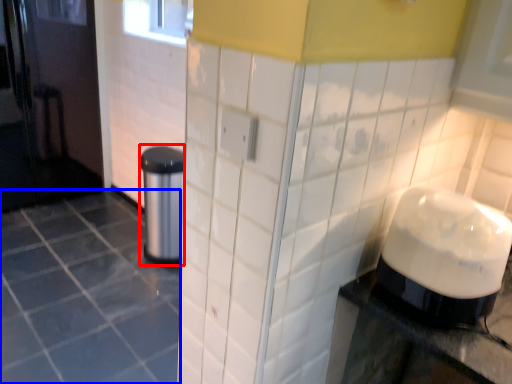
Question: Which object appears farthest to the camera in this image, appliance (highlighted by a red box) or ceramic tile (highlighted by a blue box)?

Choices:
 (A) appliance
 (B) ceramic tile

Answer: (A)